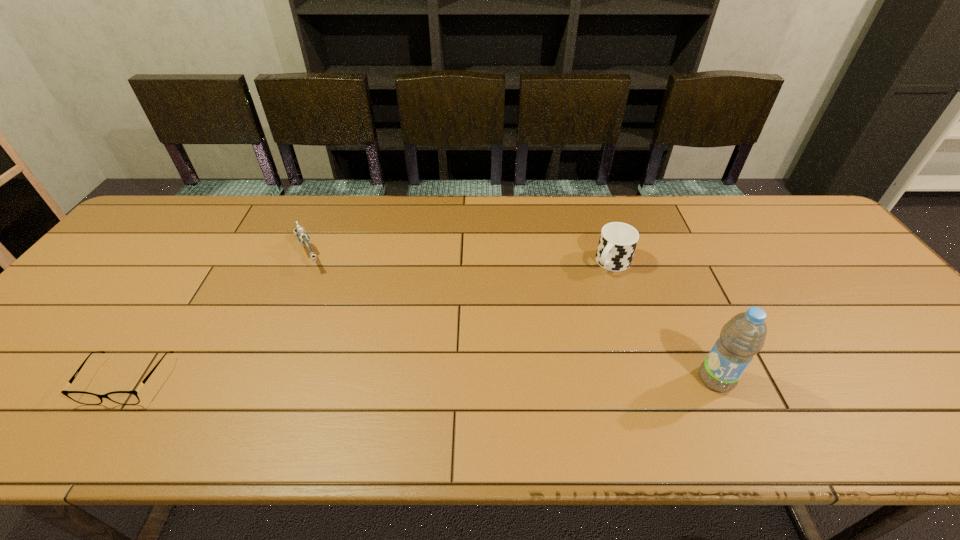
Identify the location of free space located aimed along the barrel of the gun. (355, 359).

The height and width of the screenshot is (540, 960). I want to click on free location located 0.130m on the side of the third object from left to right with the handle, so click(579, 300).

In order to click on vacant space located on the side of the third object from left to right with the handle in this screenshot , I will do `click(536, 347)`.

Image resolution: width=960 pixels, height=540 pixels. I want to click on free space located 0.360m on the side of the third object from left to right with the handle, so click(x=528, y=355).

In order to click on object at the far edge in this screenshot , I will do `click(303, 238)`.

You are a GUI agent. You are given a task and a screenshot of the screen. Output one action in this format:
    pyautogui.click(x=<x>, y=<y>)
    Task: Click on the spectacles at the near edge
    Image resolution: width=960 pixels, height=540 pixels.
    Given the screenshot: What is the action you would take?
    coord(121,397)

In order to click on water bottle that is positioned at the near edge in this screenshot , I will do click(x=742, y=337).

The height and width of the screenshot is (540, 960). Identify the location of vacant space at the far edge of the desktop. (653, 195).

In the image, there is a desktop. Where is `vacant space at the near edge`? This screenshot has width=960, height=540. vacant space at the near edge is located at coordinates (661, 376).

Where is `vacant position at the right edge of the desktop`? Image resolution: width=960 pixels, height=540 pixels. vacant position at the right edge of the desktop is located at coordinates (819, 253).